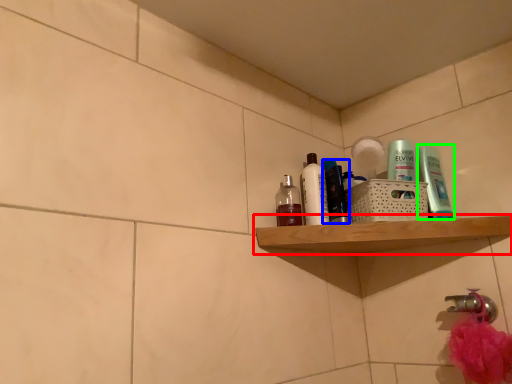
Question: Considering the real-world distances, which object is farthest from shelf (highlighted by a red box)? toiletry (highlighted by a blue box) or toiletry (highlighted by a green box)?

Choices:
 (A) toiletry
 (B) toiletry

Answer: (B)